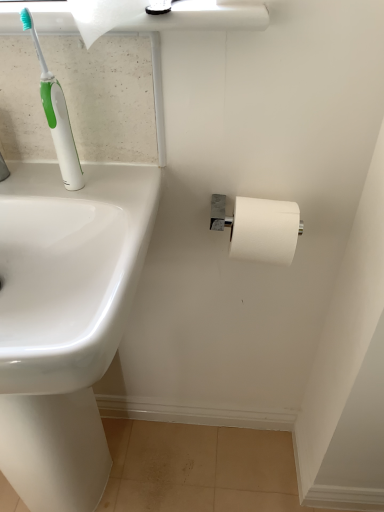
Question: Considering the relative sizes of white glossy sink at left and white matte toilet paper at right, which is the 1th toilet paper in right-to-left order, in the image provided, is white glossy sink at left smaller than white matte toilet paper at right, which is the 1th toilet paper in right-to-left order,?

Choices:
 (A) yes
 (B) no

Answer: (B)

Question: From a real-world perspective, is white glossy sink at left physically above white matte toilet paper at right, the 2th toilet paper positioned from the front?

Choices:
 (A) yes
 (B) no

Answer: (B)

Question: Could you tell me if white glossy sink at left is facing white matte toilet paper at right, the 2th toilet paper when ordered from left to right?

Choices:
 (A) yes
 (B) no

Answer: (B)

Question: Is white glossy sink at left not close to white matte toilet paper at right, positioned as the first toilet paper in bottom-to-top order?

Choices:
 (A) no
 (B) yes

Answer: (A)

Question: Is the position of white glossy sink at left less distant than that of white matte toilet paper at right, which ranks as the 1th toilet paper in back-to-front order?

Choices:
 (A) yes
 (B) no

Answer: (A)

Question: Is white matte toilet paper at right, positioned as the first toilet paper in bottom-to-top order, a part of white glossy sink at left?

Choices:
 (A) no
 (B) yes

Answer: (A)

Question: Considering the relative positions of white matte toilet paper at upper left, marked as the first toilet paper in a front-to-back arrangement, and white matte toilet paper at right, which is the 1th toilet paper in right-to-left order, in the image provided, is white matte toilet paper at upper left, marked as the first toilet paper in a front-to-back arrangement, to the left of white matte toilet paper at right, which is the 1th toilet paper in right-to-left order, from the viewer's perspective?

Choices:
 (A) no
 (B) yes

Answer: (B)

Question: Is white matte toilet paper at upper left, which ranks as the first toilet paper in top-to-bottom order, taller than white matte toilet paper at right, which is the 1th toilet paper in right-to-left order?

Choices:
 (A) no
 (B) yes

Answer: (B)

Question: Can you confirm if white matte toilet paper at upper left, the 2th toilet paper ordered from the bottom, is bigger than white matte toilet paper at right, which is the 1th toilet paper in right-to-left order?

Choices:
 (A) yes
 (B) no

Answer: (A)

Question: Can we say white matte toilet paper at upper left, which is the first toilet paper in left-to-right order, lies outside white matte toilet paper at right, the 2th toilet paper positioned from the front?

Choices:
 (A) no
 (B) yes

Answer: (B)

Question: Can you confirm if white matte toilet paper at upper left, marked as the first toilet paper in a front-to-back arrangement, is smaller than white matte toilet paper at right, the 2th toilet paper positioned from the front?

Choices:
 (A) no
 (B) yes

Answer: (A)

Question: Can you confirm if white matte toilet paper at upper left, which ranks as the first toilet paper in top-to-bottom order, is positioned to the right of white matte toilet paper at right, positioned as the second toilet paper in top-to-bottom order?

Choices:
 (A) yes
 (B) no

Answer: (B)

Question: Is white glossy sink at left inside white matte toilet paper at upper left, the 2th toilet paper ordered from the bottom?

Choices:
 (A) yes
 (B) no

Answer: (B)